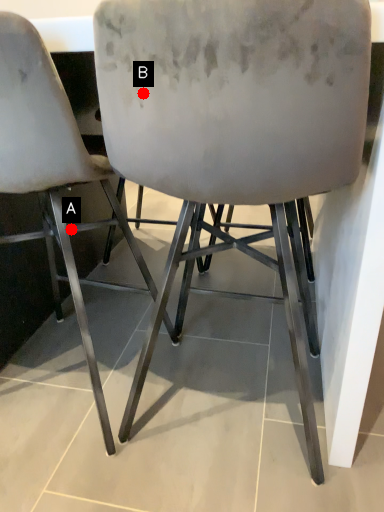
Question: Two points are circled on the image, labeled by A and B beside each circle. Which point is farther to the camera?

Choices:
 (A) A is further
 (B) B is further

Answer: (A)